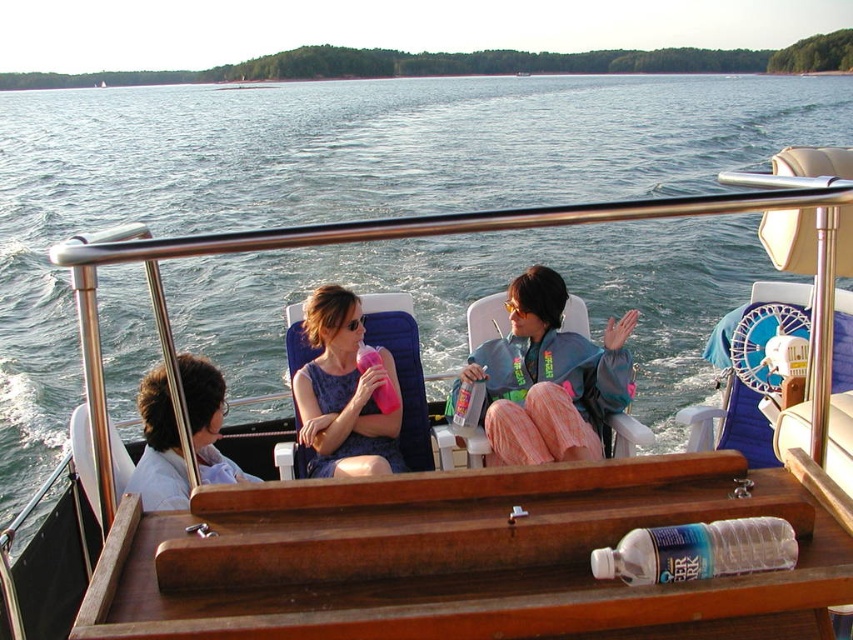
You are standing on the deck of the boat and want to reach the point marked at coordinates point (347, 314). If your walking speed is 1.2 meters per second, how many seconds will it take you to reach that point?

The distance between you and point (347, 314) is 4.64 meters. At a speed of 1.2 meters per second, it will take approximately 3.87 seconds to reach the point.

You are a photographer trying to capture a group shot of the pink fabric pants at center and the light blue shirt at center. Which object should you focus on if you want to ensure the widest part of the subject is in frame?

You should focus on the pink fabric pants at center because it might be wider than the light blue shirt at center, ensuring the widest part is captured.

What is the color of the fabric at the coordinates point (547, 378)?

The point (547, 378) corresponds to pink fabric pants at center.